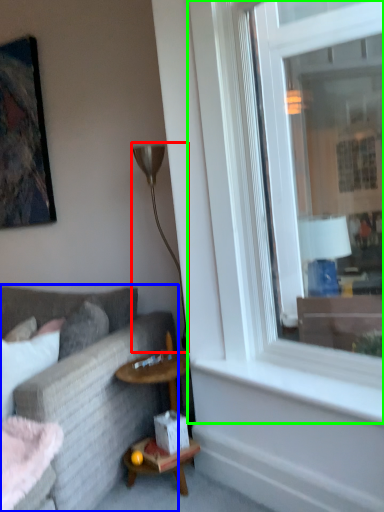
Question: Which is nearer to the lamp (highlighted by a red box)? studio couch (highlighted by a blue box) or window (highlighted by a green box).

Choices:
 (A) studio couch
 (B) window

Answer: (A)